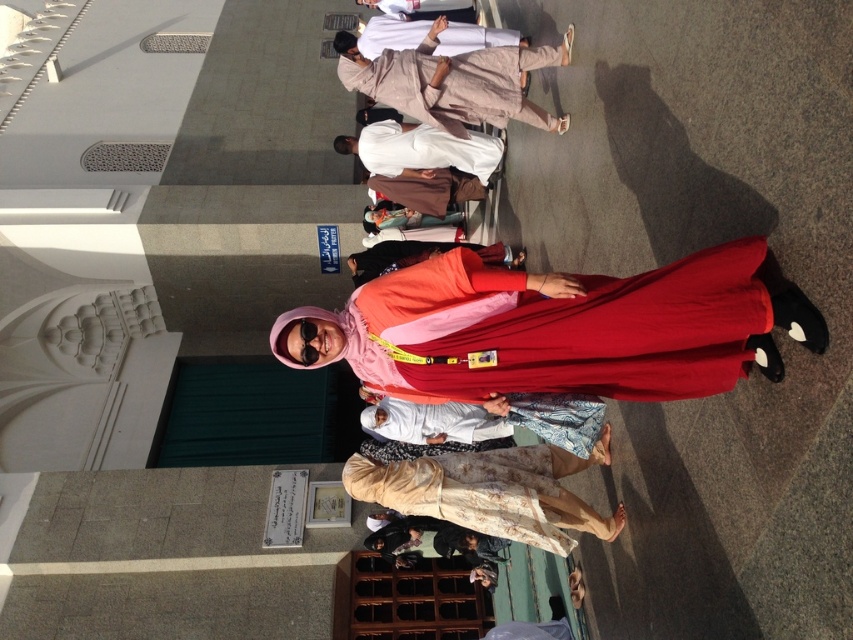
You are a photographer trying to capture a clear shot of both the beige floral dress at center and the beige fabric robe at upper center. Which object is closer to the camera?

The beige floral dress at center is closer to the camera since it is in front of the beige fabric robe at upper center.

You are a photographer trying to capture a clear shot of the matte red dress at center and the beige fabric robe at upper center. Since the two objects are close to each other in the frame, you need to adjust your camera settings to ensure both are in focus. Considering their sizes, which object should you focus on first to maximize the chances of both being sharp?

The matte red dress at center is thinner than the beige fabric robe at upper center. Since the thinner object requires a closer focus distance, you should focus on the matte red dress at center first to ensure both are in sharp focus.

You are a photographer setting up a shoot in this location. You want to ensure that both the beige floral dress at center and the beige fabric robe at upper center are visible in the frame. Given their sizes, which object should you position closer to the camera to maintain their visibility?

The beige floral dress at center has a lesser width compared to the beige fabric robe at upper center, so positioning the beige floral dress at center closer to the camera will help maintain its visibility alongside the larger robe.